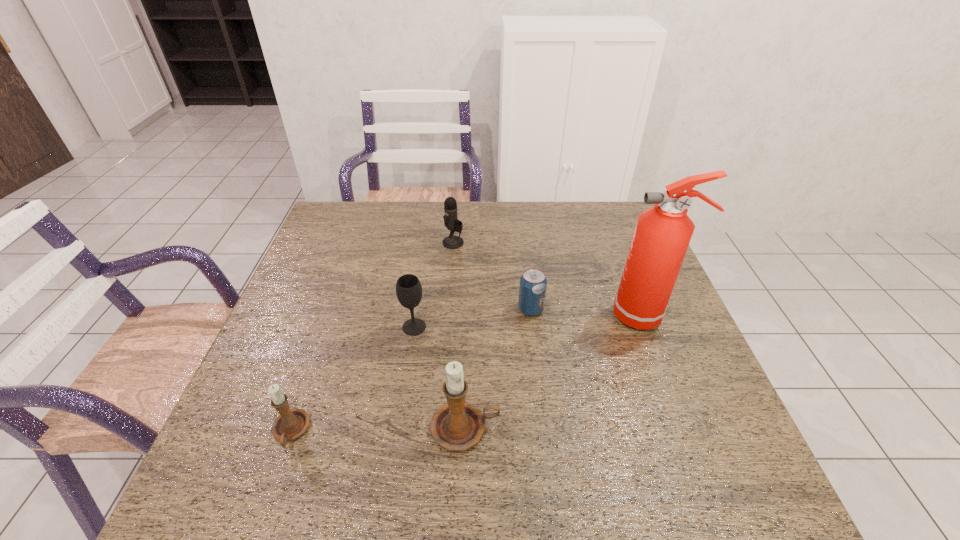
Identify the location of object that is at the near left corner. (291, 423).

The image size is (960, 540). What are the coordinates of `vacant area at the far edge` in the screenshot? It's located at (387, 219).

You are a GUI agent. You are given a task and a screenshot of the screen. Output one action in this format:
    pyautogui.click(x=<x>, y=<y>)
    Task: Click on the free space at the near edge of the desktop
    Image resolution: width=960 pixels, height=540 pixels.
    Given the screenshot: What is the action you would take?
    pyautogui.click(x=377, y=446)

The width and height of the screenshot is (960, 540). Find the location of `free region at the left edge of the desktop`. free region at the left edge of the desktop is located at coordinates (311, 254).

Find the location of `vacant position at the right edge of the desktop`. vacant position at the right edge of the desktop is located at coordinates click(615, 255).

This screenshot has width=960, height=540. I want to click on vacant space at the far left corner of the desktop, so click(347, 236).

The height and width of the screenshot is (540, 960). In order to click on vacant space that's between the farthest object and the pop soda in this screenshot , I will do `click(492, 276)`.

Identify the location of empty location between the pop soda and the tallest object. (588, 312).

Identify the location of free space between the second tallest object and the rightmost object. (556, 372).

Where is `vacant space that is in between the tallest object and the shortest object`? vacant space that is in between the tallest object and the shortest object is located at coordinates (588, 312).